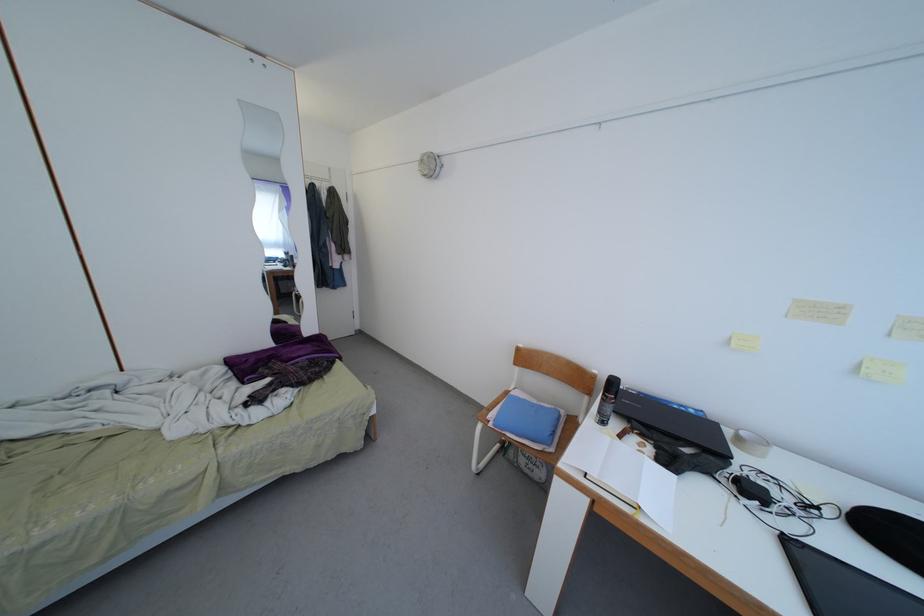
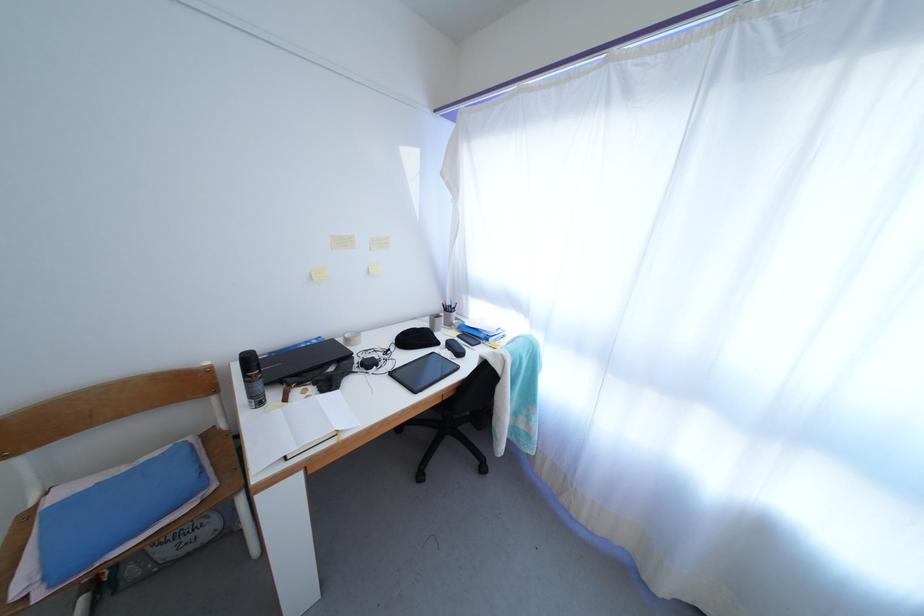
Where in the second image is the point corresponding to point 794,546 from the first image?

(397, 379)